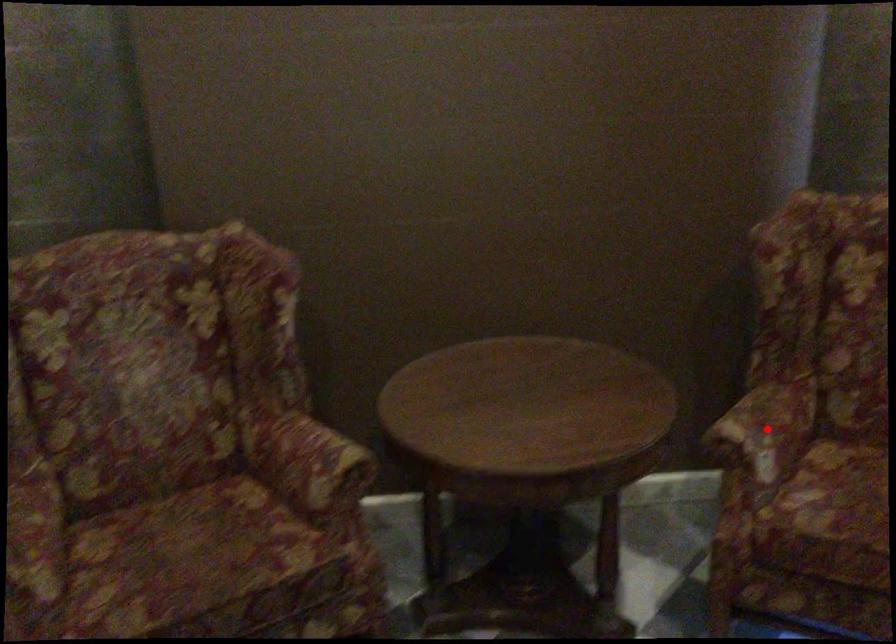
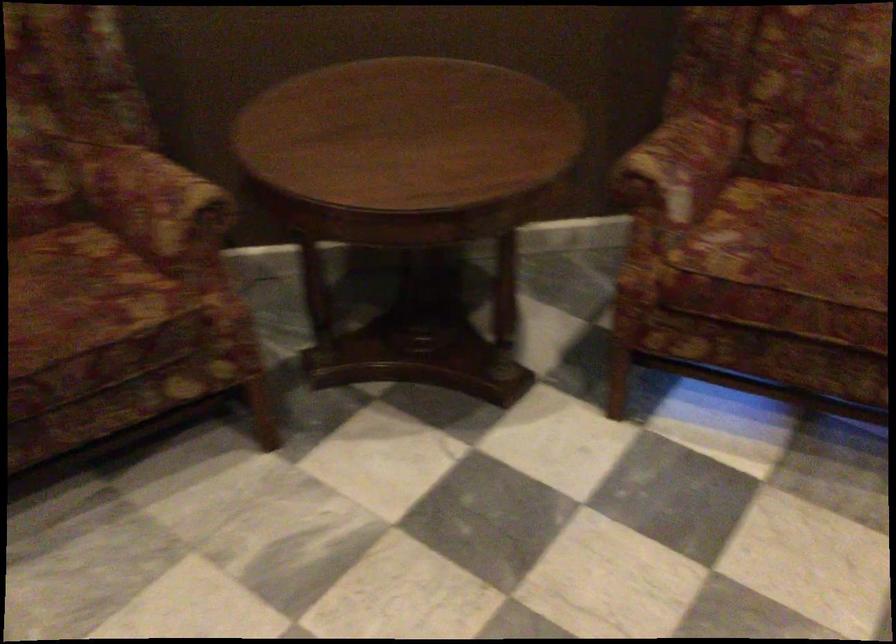
Question: I am providing you with two images of the same scene from different viewpoints. A red point is shown in image1. For the corresponding object point in image2, is it positioned nearer or farther from the camera?

Choices:
 (A) Nearer
 (B) Farther

Answer: (A)